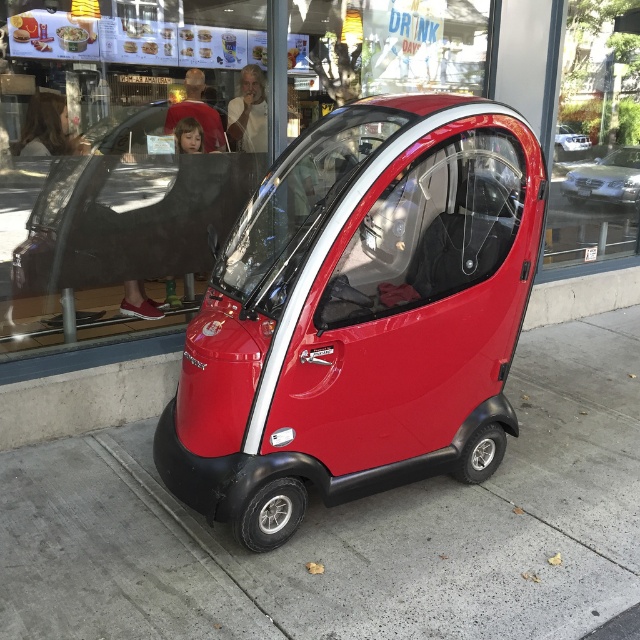
You are a delivery robot that needs to park your vehicle on the glossy concrete pavement at lower center. The metallic silver car at center is currently occupying part of the pavement. Can you estimate if there is enough space to park your vehicle on the remaining part of the pavement?

The glossy concrete pavement at lower center might be wider than metallic silver car at center, so there could be enough space left to park the delivery robot, but it depends on the exact dimensions of both the pavement and the car.

Based on the scene, can the metallic silver car at center be moved forward on the glossy concrete pavement at lower center without needing to reverse first?

The glossy concrete pavement at lower center has a larger size compared to metallic silver car at center, so there is enough space for the metallic silver car at center to move forward without needing to reverse first.

You are a pedestrian standing on the sidewalk and want to cross the street. There are two cars in front of you, the glossy red car at center and the metallic silver car at center. Which car is closer to you?

The glossy red car at center is closer to you because it is in front of the metallic silver car at center.